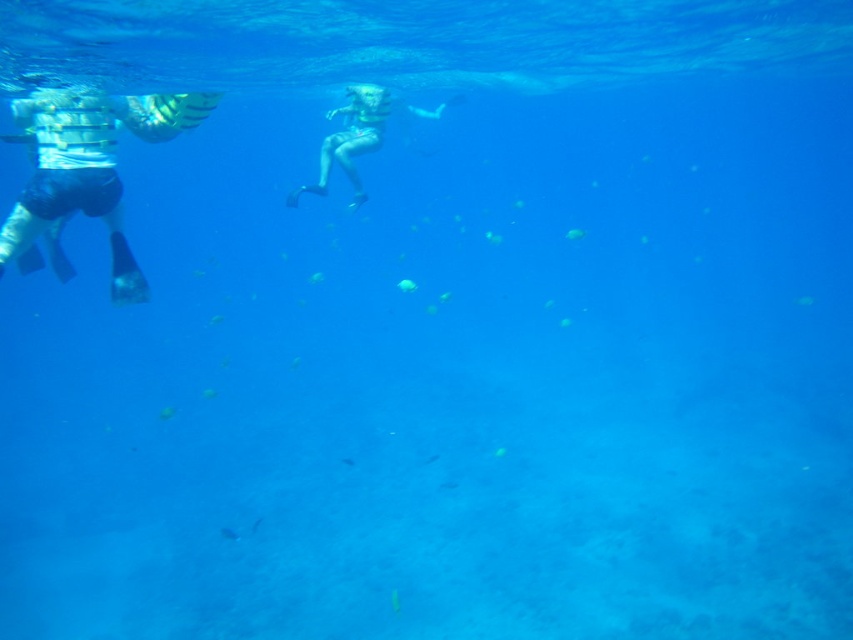
You are a diver who wants to reach a point underwater that is exactly 8 meters away from the camera. Based on the image provided, can you confirm if the point at coordinates point (155, 106) is the correct location?

The point at coordinates point (155, 106) is exactly 8.01 meters away from the camera, so yes, it is the correct location.

Consider the image. You are a marine biologist studying underwater visibility. You observe the white striped swim trunks at left in the image. Based on their position coordinates, can you estimate how far they are from the center of the image?

The white striped swim trunks at left are located at coordinates point (88,168), which means they are positioned closer to the upper left corner of the image rather than the center. Therefore, they are farther from the center compared to objects near the middle of the frame.

In the scene shown: You are a marine biologist observing the underwater scene. You need to locate the white striped swim trunks at left and the smooth skin diver at center. Which of these two objects is located lower in the image?

The white striped swim trunks at left is positioned under the smooth skin diver at center, so it is located lower in the image.